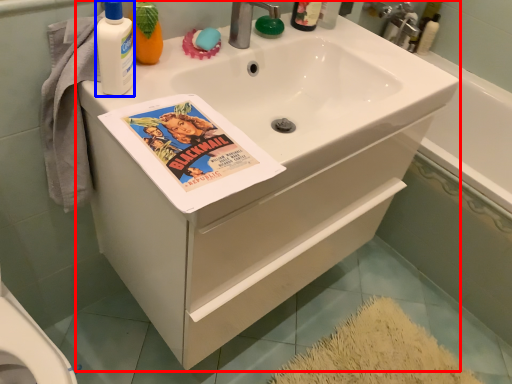
Question: Which point is closer to the camera, bathroom cabinet (highlighted by a red box) or cleaning product (highlighted by a blue box)?

Choices:
 (A) bathroom cabinet
 (B) cleaning product

Answer: (B)